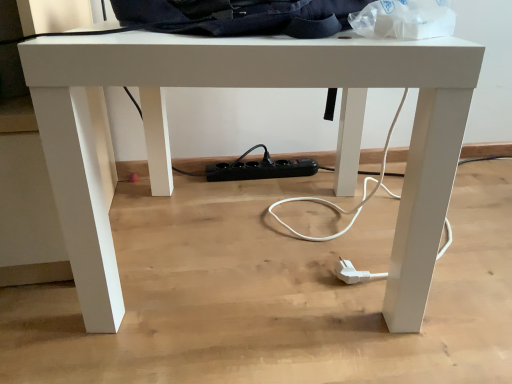
Where is `free location to the left of transparent plastic bag at upper right`? free location to the left of transparent plastic bag at upper right is located at coordinates (275, 30).